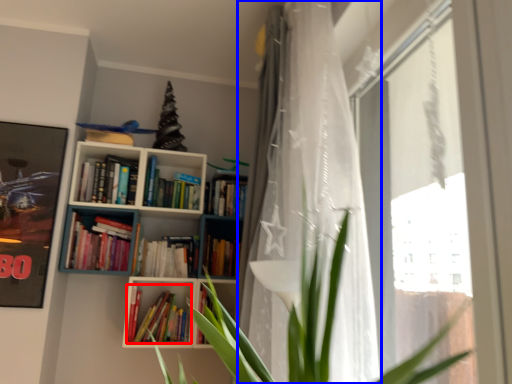
Question: Among these objects, which one is nearest to the camera, book (highlighted by a red box) or curtain (highlighted by a blue box)?

Choices:
 (A) book
 (B) curtain

Answer: (B)